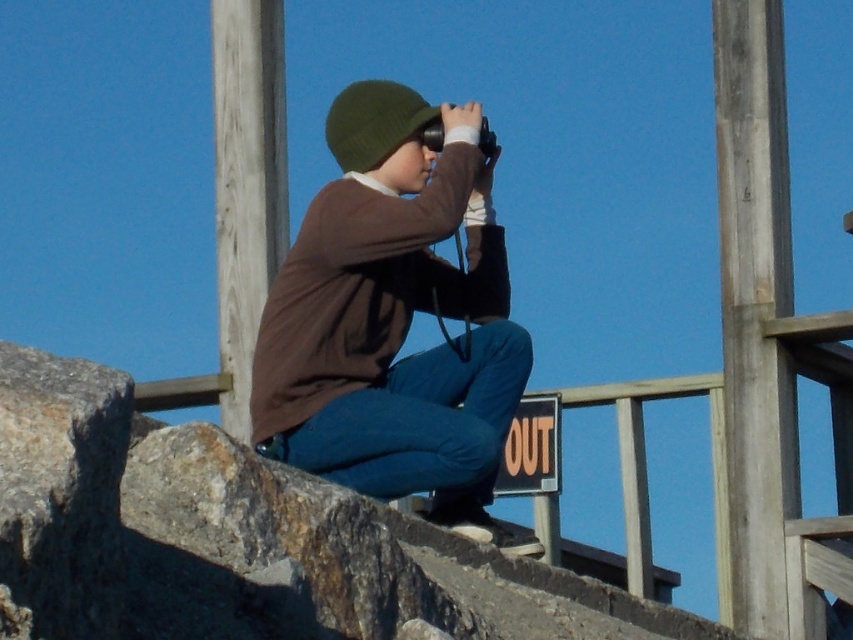
Based on the photo, you are an outdoor enthusiast planning to attach a lightweight camera to the smooth gray pole at upper right and the green woolen hat at center. Based on the scene, which object would be more suitable for securely attaching the camera?

The green woolen hat at center would be more suitable for securely attaching the camera because the smooth gray pole at upper right is thinner than the green woolen hat at center, making the hat a sturdier option.

You are an outdoor enthusiast planning to take a photo of the brown cotton shirt at center and the smooth wood pole at upper left. Which object should you focus on first if you want to capture both in a single frame without moving the camera?

You should focus on the brown cotton shirt at center first because it occupies less space than the smooth wood pole at upper left, allowing more room to include both in the frame.